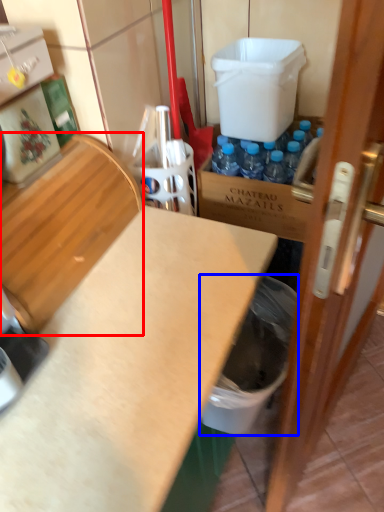
Question: Which object is further to the camera taking this photo, wood (highlighted by a red box) or garbage (highlighted by a blue box)?

Choices:
 (A) wood
 (B) garbage

Answer: (B)